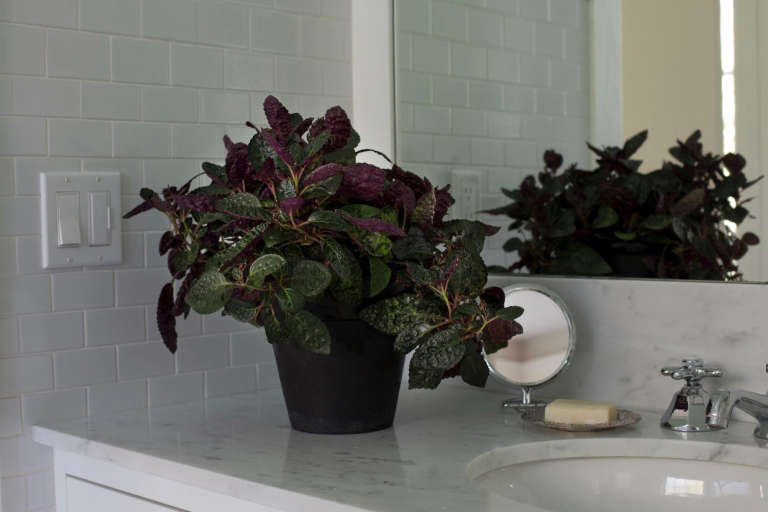
At what (x,y) coordinates should I click in order to perform the action: click on faucet. Please return your answer as a coordinate pair (x, y). This screenshot has height=512, width=768. Looking at the image, I should click on (725, 409).